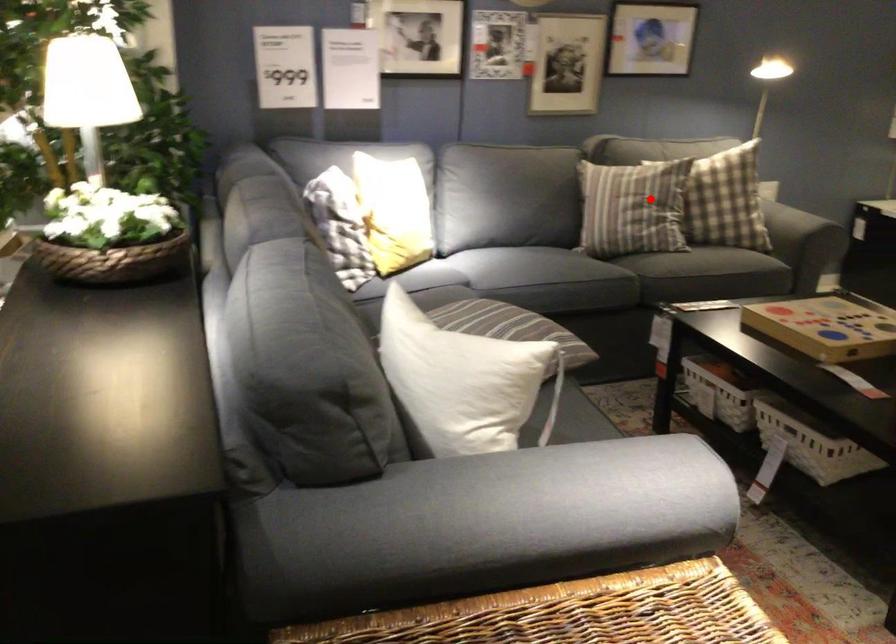
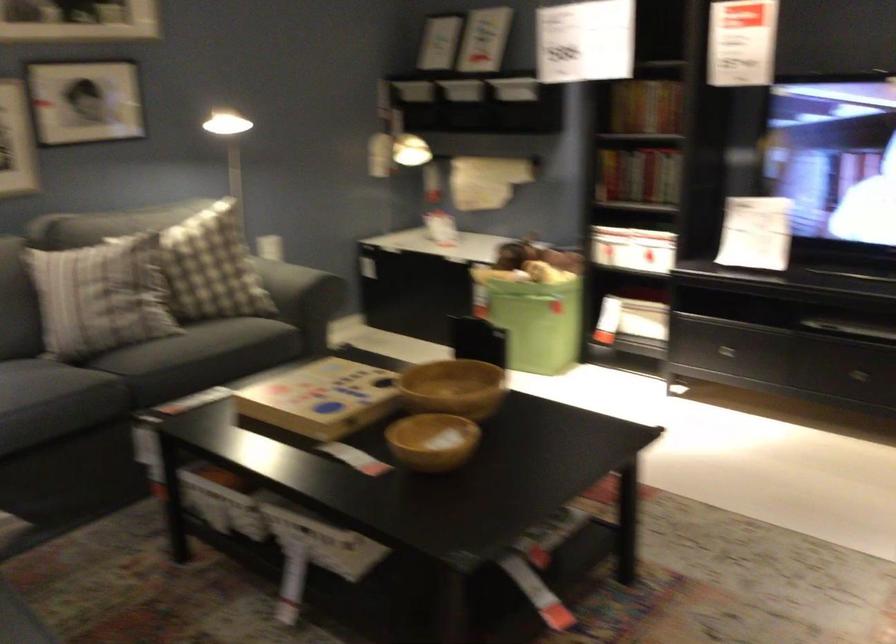
Find the pixel in the second image that matches the highlighted location in the first image.

(99, 296)